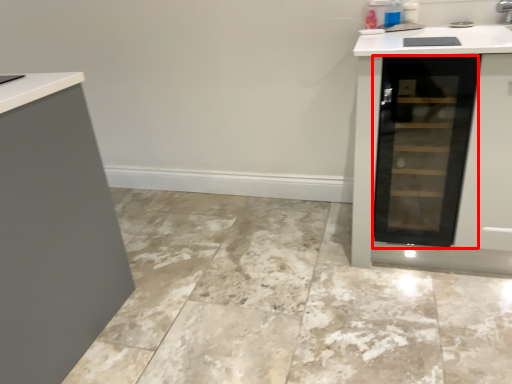
Question: From the image, what is the correct spatial relationship of glass door (annotated by the red box) in relation to ceramic tile?

Choices:
 (A) left
 (B) right

Answer: (B)